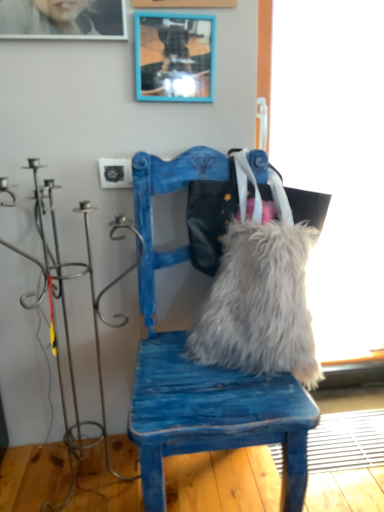
Question: Does blue distressed wood chair at center touch fuzzy fabric messenger bag at center?

Choices:
 (A) yes
 (B) no

Answer: (B)

Question: Considering the relative sizes of blue distressed wood chair at center and fuzzy fabric messenger bag at center in the image provided, is blue distressed wood chair at center smaller than fuzzy fabric messenger bag at center?

Choices:
 (A) yes
 (B) no

Answer: (B)

Question: Is blue distressed wood chair at center not close to fuzzy fabric messenger bag at center?

Choices:
 (A) yes
 (B) no

Answer: (B)

Question: From the image's perspective, is blue distressed wood chair at center under fuzzy fabric messenger bag at center?

Choices:
 (A) yes
 (B) no

Answer: (A)

Question: Is blue distressed wood chair at center thinner than fuzzy fabric messenger bag at center?

Choices:
 (A) yes
 (B) no

Answer: (B)

Question: From a real-world perspective, relative to blue painted wood picture frame at upper center, is white fluffy pillow at center vertically above or below?

Choices:
 (A) below
 (B) above

Answer: (A)

Question: Considering the positions of point (238, 362) and point (170, 61), is point (238, 362) closer or farther from the camera than point (170, 61)?

Choices:
 (A) farther
 (B) closer

Answer: (B)

Question: Is white fluffy pillow at center spatially inside blue painted wood picture frame at upper center, or outside of it?

Choices:
 (A) outside
 (B) inside

Answer: (A)

Question: From the image's perspective, is white fluffy pillow at center positioned above or below blue painted wood picture frame at upper center?

Choices:
 (A) below
 (B) above

Answer: (A)

Question: Considering the positions of blue distressed wood chair at center and white fluffy pillow at center in the image, is blue distressed wood chair at center wider or thinner than white fluffy pillow at center?

Choices:
 (A) thin
 (B) wide

Answer: (B)

Question: Considering their positions, is blue distressed wood chair at center located in front of or behind white fluffy pillow at center?

Choices:
 (A) front
 (B) behind

Answer: (A)

Question: Is blue distressed wood chair at center inside or outside of white fluffy pillow at center?

Choices:
 (A) outside
 (B) inside

Answer: (A)

Question: From a real-world perspective, is blue distressed wood chair at center positioned above or below white fluffy pillow at center?

Choices:
 (A) below
 (B) above

Answer: (B)

Question: Considering the relative positions of blue distressed wood chair at center and blue painted wood picture frame at upper center in the image provided, is blue distressed wood chair at center to the left or to the right of blue painted wood picture frame at upper center?

Choices:
 (A) left
 (B) right

Answer: (B)

Question: In terms of width, does blue distressed wood chair at center look wider or thinner when compared to blue painted wood picture frame at upper center?

Choices:
 (A) wide
 (B) thin

Answer: (A)